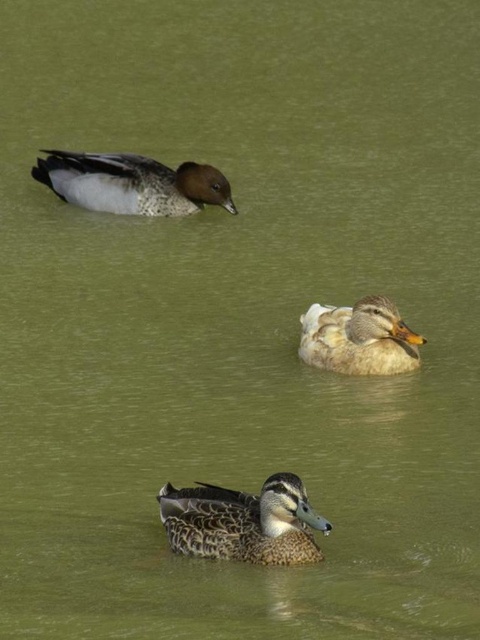
Question: Which object is positioned farthest from the white fluffy duck at center?

Choices:
 (A) speckled feathered duck at upper left
 (B) speckled feathered duck at center

Answer: (A)

Question: Can you confirm if speckled feathered duck at center is positioned below white fluffy duck at center?

Choices:
 (A) no
 (B) yes

Answer: (B)

Question: Which of the following is the closest to the observer?

Choices:
 (A) white fluffy duck at center
 (B) speckled feathered duck at center

Answer: (B)

Question: Is speckled feathered duck at upper left to the left of white fluffy duck at center from the viewer's perspective?

Choices:
 (A) no
 (B) yes

Answer: (B)

Question: Does speckled feathered duck at center appear under speckled feathered duck at upper left?

Choices:
 (A) no
 (B) yes

Answer: (B)

Question: Among these objects, which one is farthest from the camera?

Choices:
 (A) speckled feathered duck at center
 (B) speckled feathered duck at upper left
 (C) white fluffy duck at center

Answer: (B)